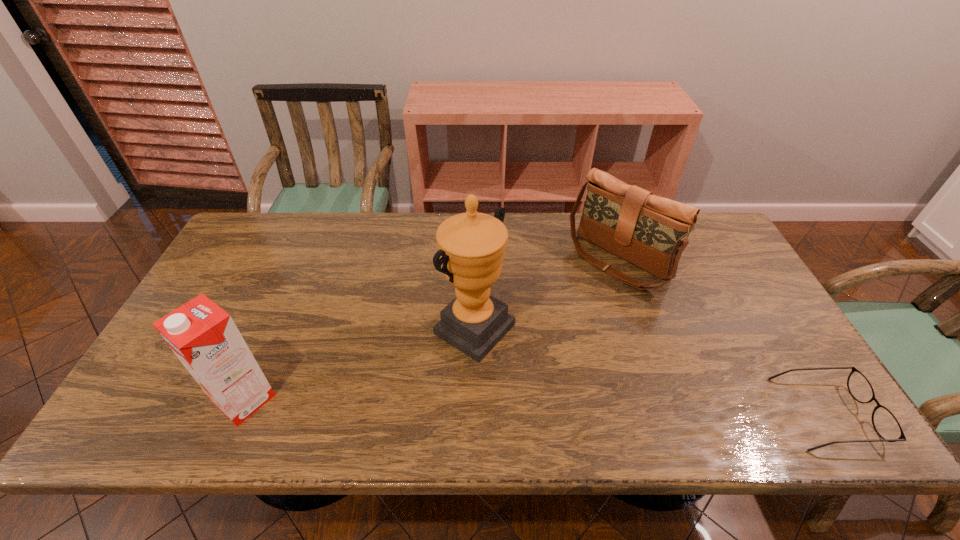
The image size is (960, 540). I want to click on the leftmost object, so click(x=203, y=336).

Identify the location of the second tallest object. (203, 336).

Image resolution: width=960 pixels, height=540 pixels. In order to click on spectacles in this screenshot , I will do `click(886, 425)`.

I want to click on the shortest object, so click(x=886, y=425).

I want to click on award, so click(x=471, y=246).

Where is `the tallest object`? the tallest object is located at coordinates tap(471, 246).

Find the location of a particular element. the second object from right to left is located at coordinates (651, 232).

This screenshot has width=960, height=540. I want to click on the farthest object, so click(x=651, y=232).

Locate an element on the screen. The width and height of the screenshot is (960, 540). free space located on the back of the second tallest object is located at coordinates (296, 279).

Where is `vacant space located 0.060m at the front of the tallest object with handles`? The image size is (960, 540). vacant space located 0.060m at the front of the tallest object with handles is located at coordinates (528, 361).